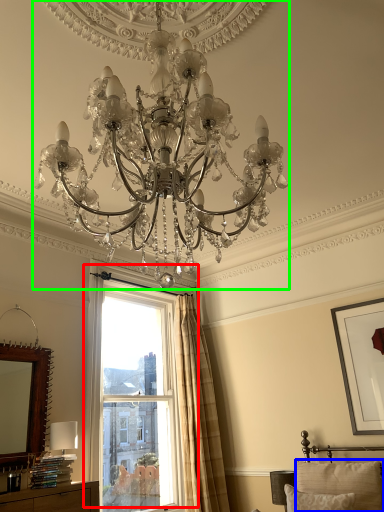
Question: Estimate the real-world distances between objects in this image. Which object is farther from window (highlighted by a red box), pillow (highlighted by a blue box) or lamp (highlighted by a green box)?

Choices:
 (A) pillow
 (B) lamp

Answer: (B)